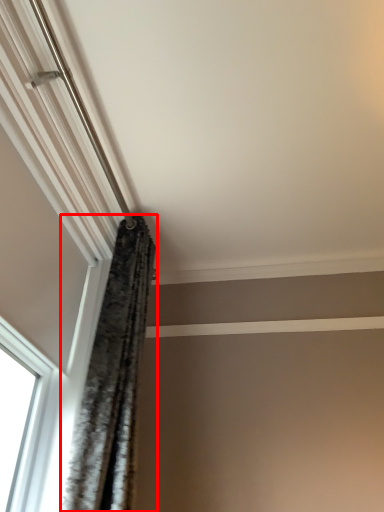
Question: From the image's perspective, where is curtain (annotated by the red box) located in relation to window in the image?

Choices:
 (A) above
 (B) below

Answer: (B)